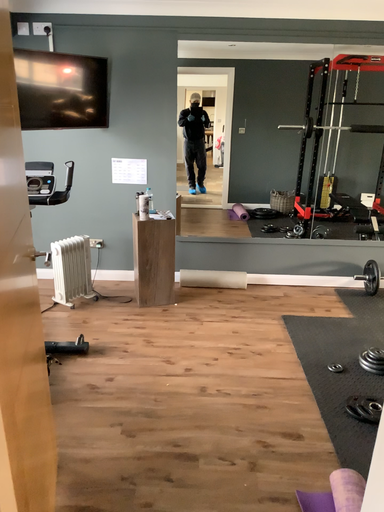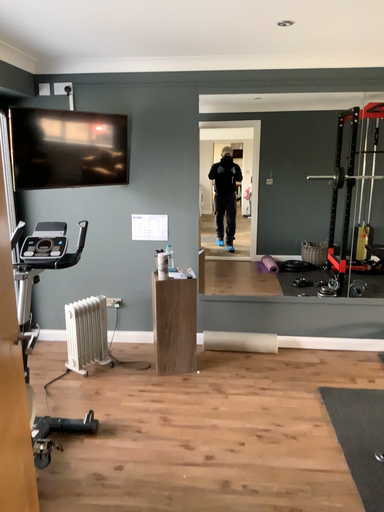
Question: Which way did the camera rotate in the video?

Choices:
 (A) rotated upward
 (B) rotated downward

Answer: (A)